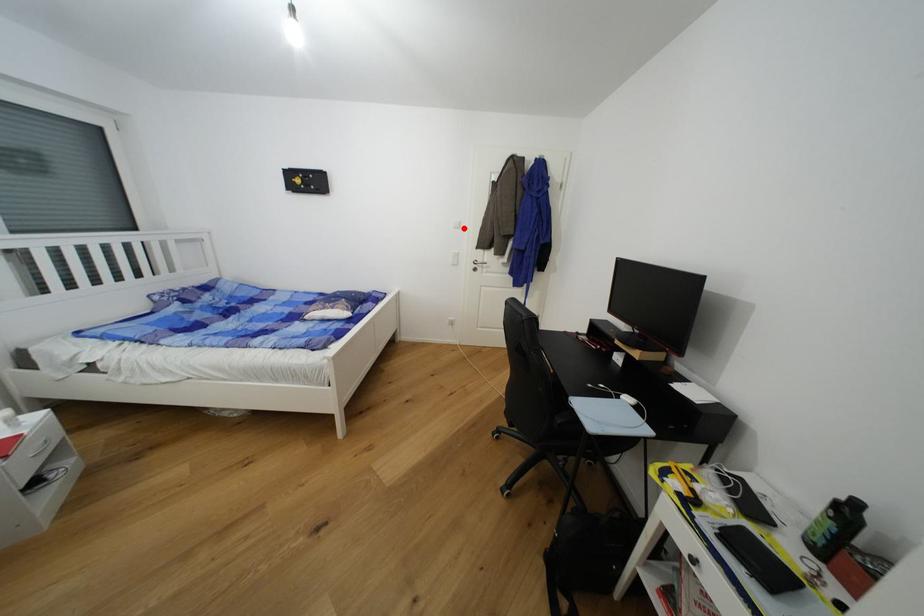
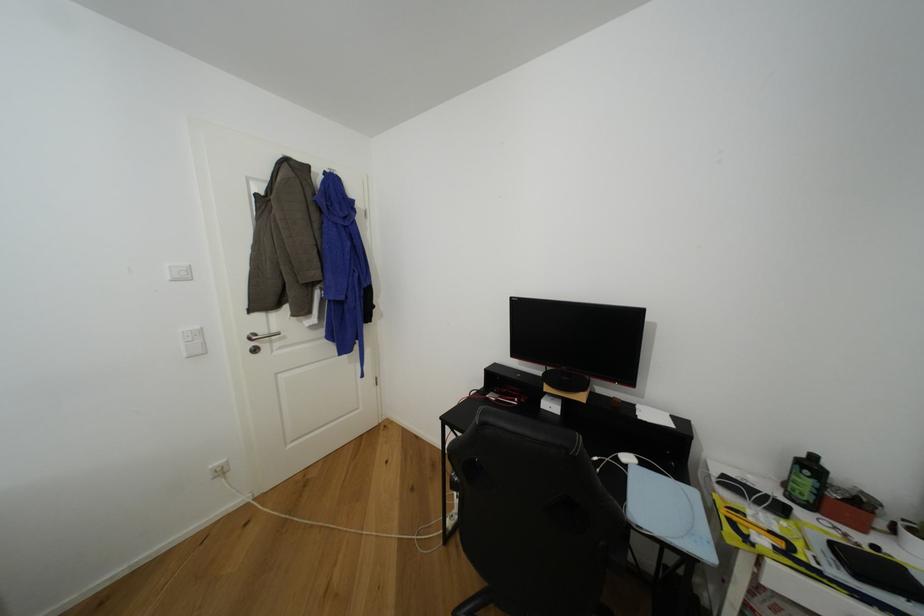
The point at the highlighted location is marked in the first image. Where is the corresponding point in the second image?

(190, 278)